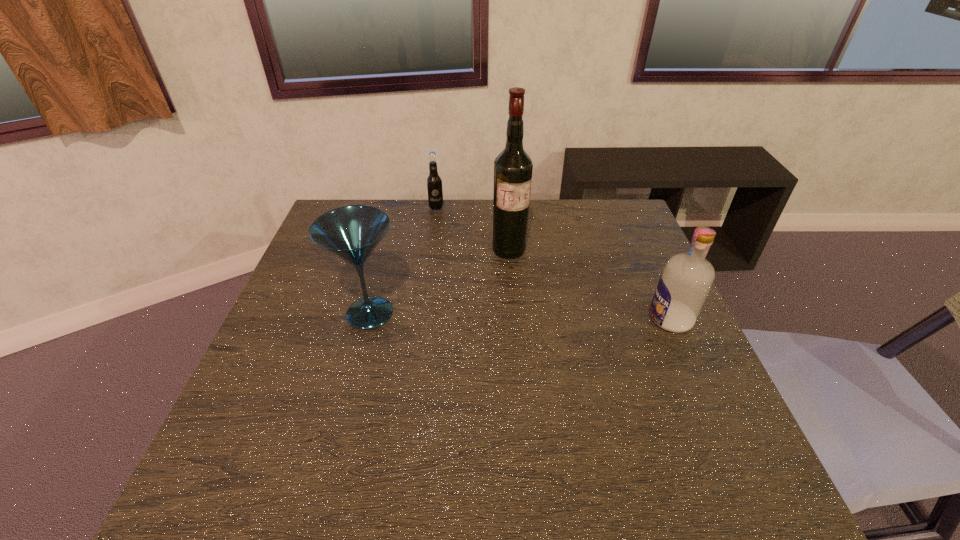
In the image, there is a desktop. Where is `free space at the far edge`? The image size is (960, 540). free space at the far edge is located at coordinates (396, 217).

I want to click on vacant space at the near edge, so click(x=635, y=407).

Identify the location of vacant space at the left edge of the desktop. (x=264, y=376).

Where is `vacant point at the right edge`? The height and width of the screenshot is (540, 960). vacant point at the right edge is located at coordinates (703, 370).

In the image, there is a desktop. At what (x,y) coordinates should I click in order to perform the action: click on vacant space at the far left corner. Please return your answer as a coordinate pair (x, y). The width and height of the screenshot is (960, 540). Looking at the image, I should click on (351, 203).

This screenshot has width=960, height=540. What are the coordinates of `vacant space at the near left corner of the desktop` in the screenshot? It's located at (252, 429).

In the image, there is a desktop. At what (x,y) coordinates should I click in order to perform the action: click on free space at the far right corner. Please return your answer as a coordinate pair (x, y). Looking at the image, I should click on (604, 233).

In the image, there is a desktop. Where is `vacant space at the near right corner`? The width and height of the screenshot is (960, 540). vacant space at the near right corner is located at coordinates (718, 433).

Locate an element on the screen. The width and height of the screenshot is (960, 540). vacant area that lies between the root beer and the rightmost object is located at coordinates (553, 264).

You are a GUI agent. You are given a task and a screenshot of the screen. Output one action in this format:
    pyautogui.click(x=<x>, y=<y>)
    Task: Click on the free spot between the leftmost object and the farthest object
    
    Given the screenshot: What is the action you would take?
    pyautogui.click(x=403, y=261)